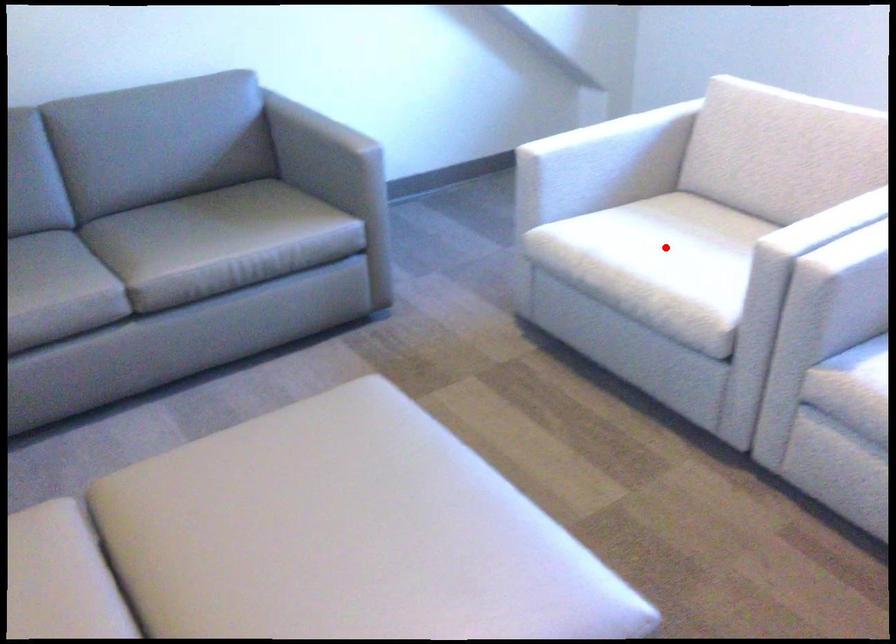
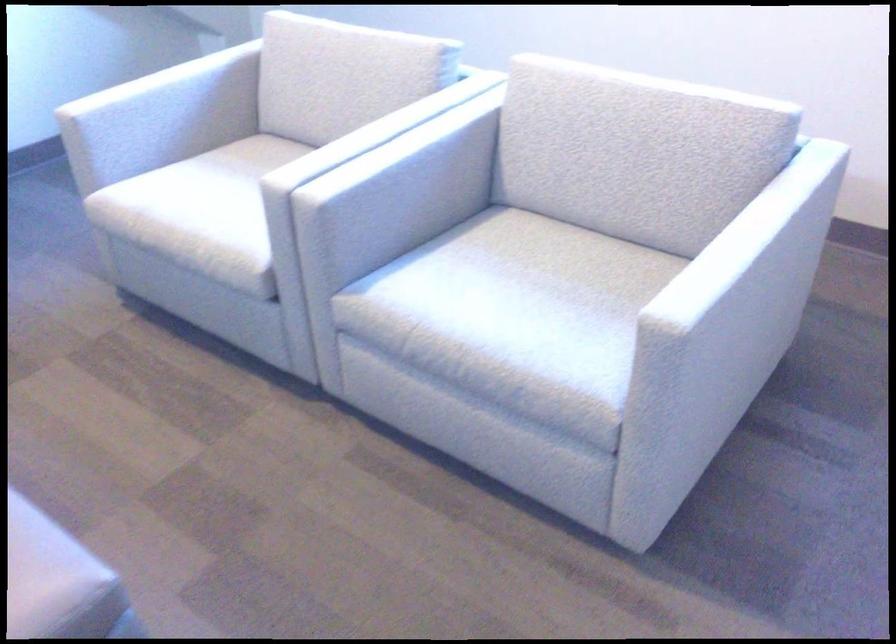
Find the pixel in the second image that matches the highlighted location in the first image.

(220, 196)